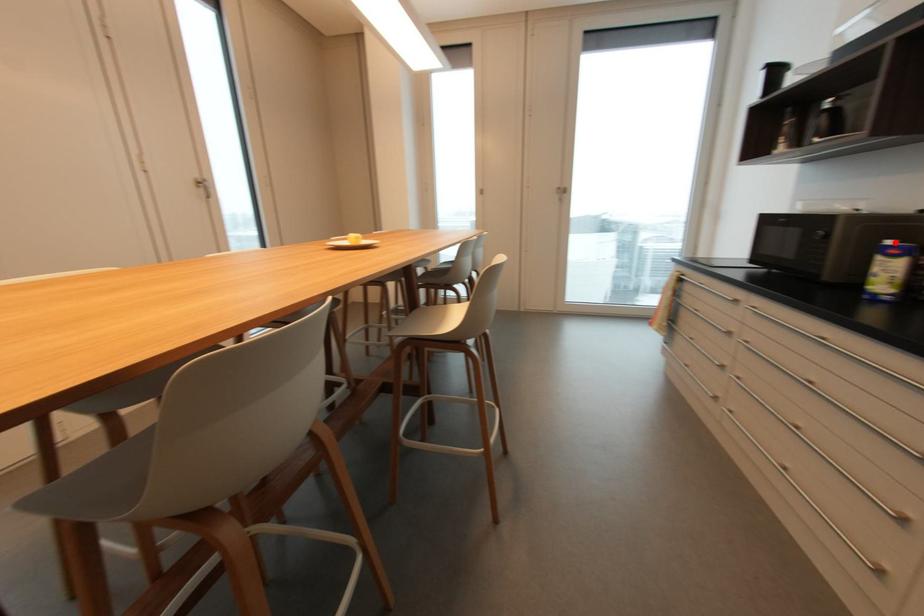
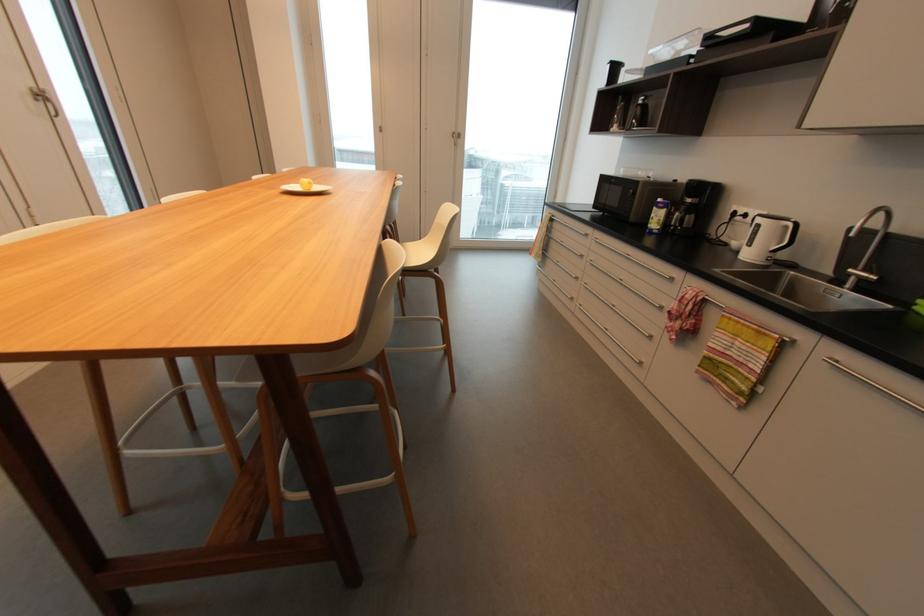
Question: I am providing you with two images of the same scene from different viewpoints. A red point is marked on the first image. Is the red point's position out of view in image 2?

Choices:
 (A) Yes
 (B) No

Answer: (B)